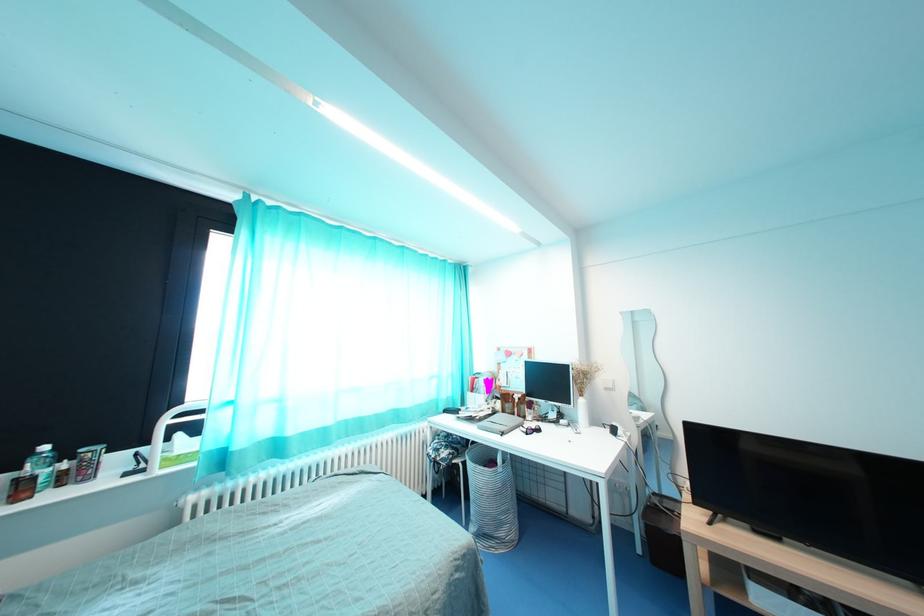
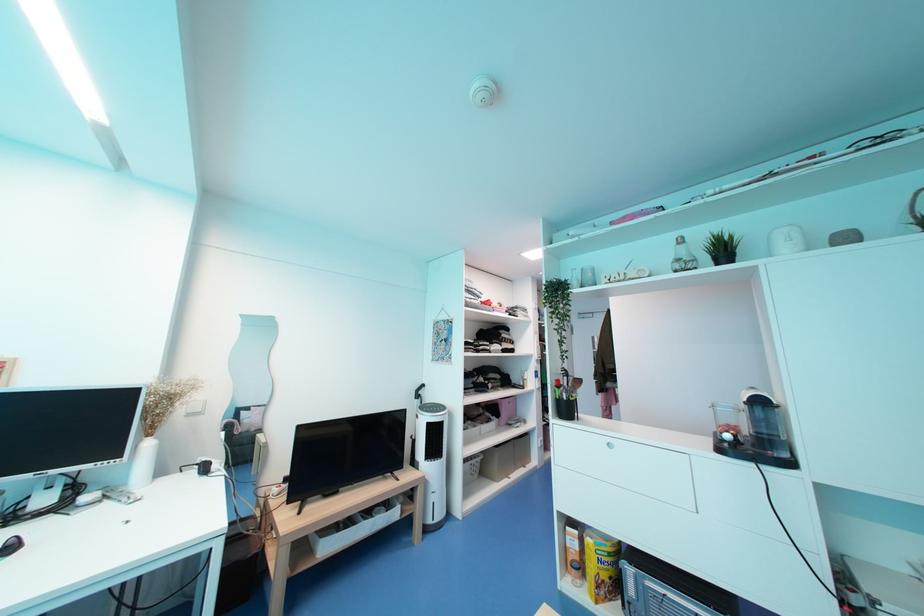
Question: The first image is from the beginning of the video and the second image is from the end. How did the camera likely rotate when shooting the video?

Choices:
 (A) Left
 (B) Right
 (C) Up
 (D) Down

Answer: (B)